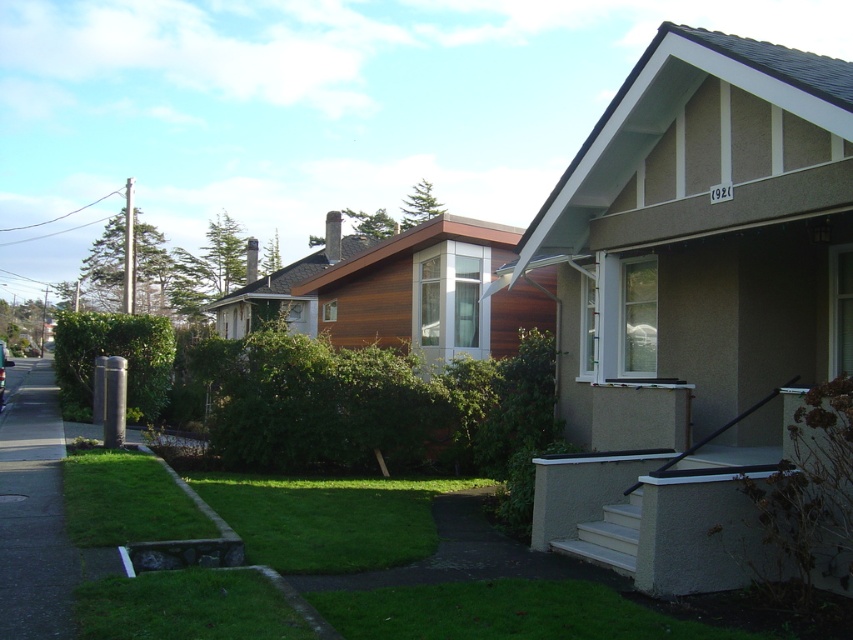
Does gray concrete sidewalk at lower left have a smaller size compared to green grass at lower center?

Actually, gray concrete sidewalk at lower left might be larger than green grass at lower center.

Consider the image. Does gray concrete sidewalk at lower left appear on the right side of green grass at lower center?

In fact, gray concrete sidewalk at lower left is to the left of green grass at lower center.

What do you see at coordinates (33, 513) in the screenshot?
I see `gray concrete sidewalk at lower left` at bounding box center [33, 513].

Identify the location of gray concrete sidewalk at lower left. The width and height of the screenshot is (853, 640). pos(33,513).